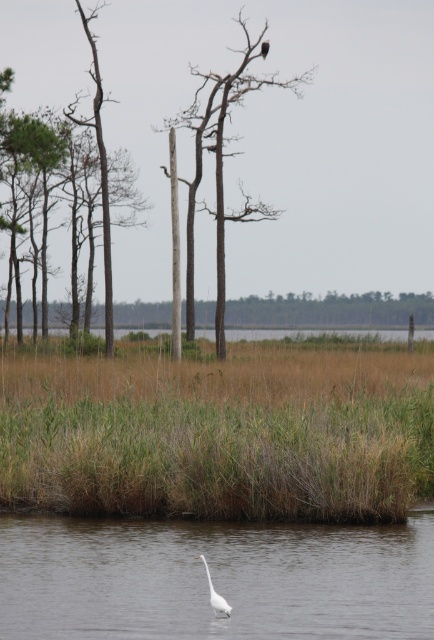
Does brown wood tree at center appear under white matte bird at lower center?

No.

Is brown wood tree at center smaller than white matte bird at lower center?

Actually, brown wood tree at center might be larger than white matte bird at lower center.

This screenshot has width=434, height=640. In order to click on brown wood tree at center in this screenshot , I will do `click(222, 163)`.

Consider the image. Does white smooth water at lower center appear over white matte bird at lower center?

Actually, white smooth water at lower center is below white matte bird at lower center.

From the picture: Can you confirm if white smooth water at lower center is thinner than white matte bird at lower center?

No.

Where is `white smooth water at lower center`? The image size is (434, 640). white smooth water at lower center is located at coordinates (213, 579).

Can you confirm if white smooth water at lower center is wider than brown wood tree at center?

No, white smooth water at lower center is not wider than brown wood tree at center.

Does white smooth water at lower center appear on the right side of brown wood tree at center?

Yes, white smooth water at lower center is to the right of brown wood tree at center.

Locate an element on the screen. white smooth water at lower center is located at coordinates (213, 579).